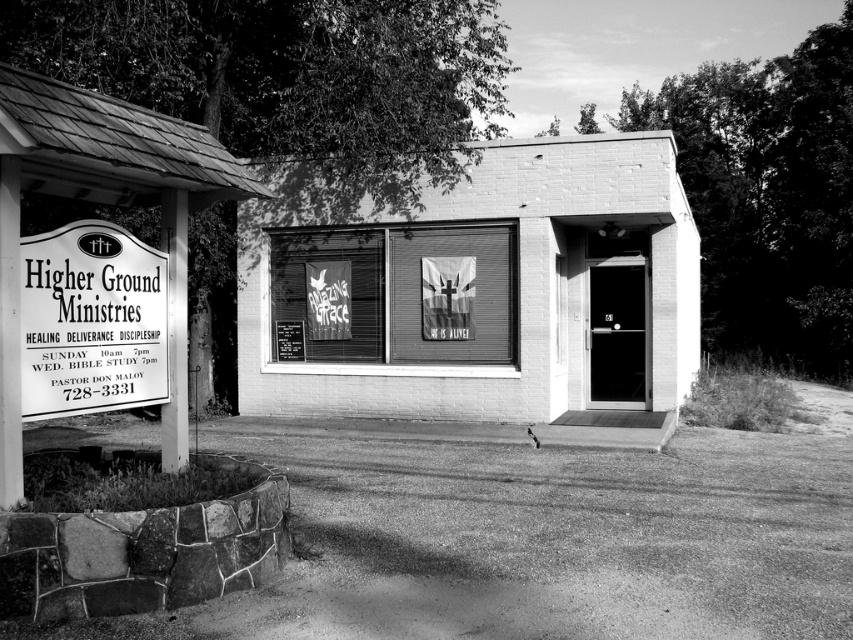
What is the location of the point with coordinates (x=483, y=294) in the image?

The point with coordinates (x=483, y=294) is located on the white brick building at center.